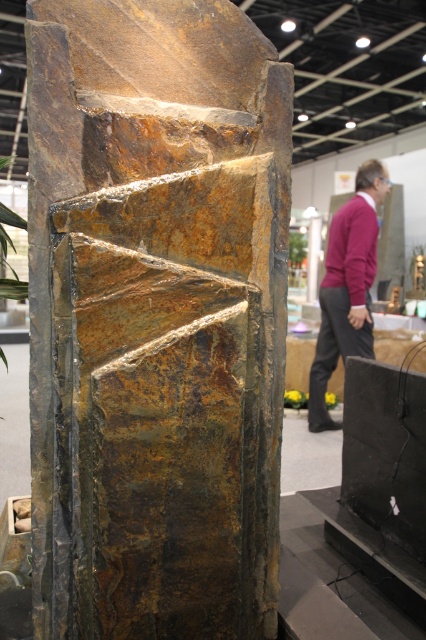
Question: From the image, what is the correct spatial relationship of rusty stone sculpture at center in relation to maroon sweater at center?

Choices:
 (A) above
 (B) below

Answer: (B)

Question: Among these points, which one is farthest from the camera?

Choices:
 (A) (141, 451)
 (B) (333, 300)

Answer: (B)

Question: Is rusty stone sculpture at center bigger than maroon sweater at center?

Choices:
 (A) yes
 (B) no

Answer: (B)

Question: Which point is closer to the camera?

Choices:
 (A) rusty stone sculpture at center
 (B) maroon sweater at center

Answer: (A)

Question: Among these objects, which one is farthest from the camera?

Choices:
 (A) maroon sweater at center
 (B) rusty stone sculpture at center

Answer: (A)

Question: From the image, what is the correct spatial relationship of rusty stone sculpture at center in relation to maroon sweater at center?

Choices:
 (A) right
 (B) left

Answer: (B)